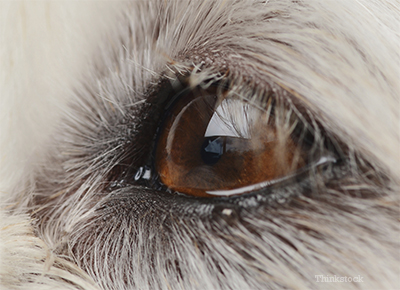
Find the location of a particular element. The height and width of the screenshot is (290, 400). white fur is located at coordinates (65, 87).